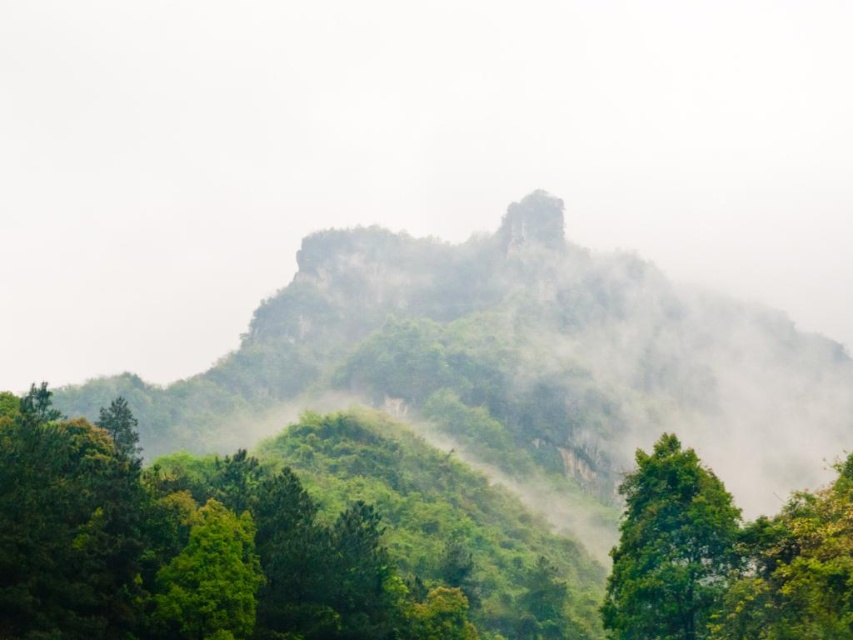
In the misty mountain landscape, you see a green leafy tree at center and a green leafy tree at lower right. Which tree is positioned to the left when viewed from your perspective?

The green leafy tree at center is positioned to the left of the green leafy tree at lower right.

In the scene shown: You are standing in the misty mountain landscape and see the green leafy tree at center and the green leafy tree at lower right. Which tree is closer to you?

The green leafy tree at center is closer because the green leafy tree at lower right is behind it.